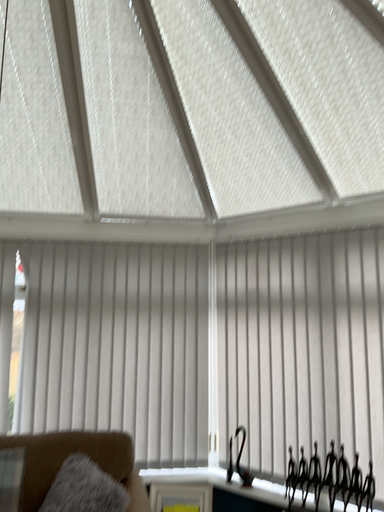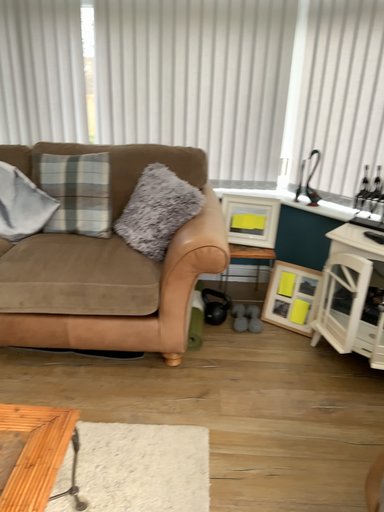
Question: How did the camera likely rotate when shooting the video?

Choices:
 (A) rotated left
 (B) rotated right

Answer: (A)